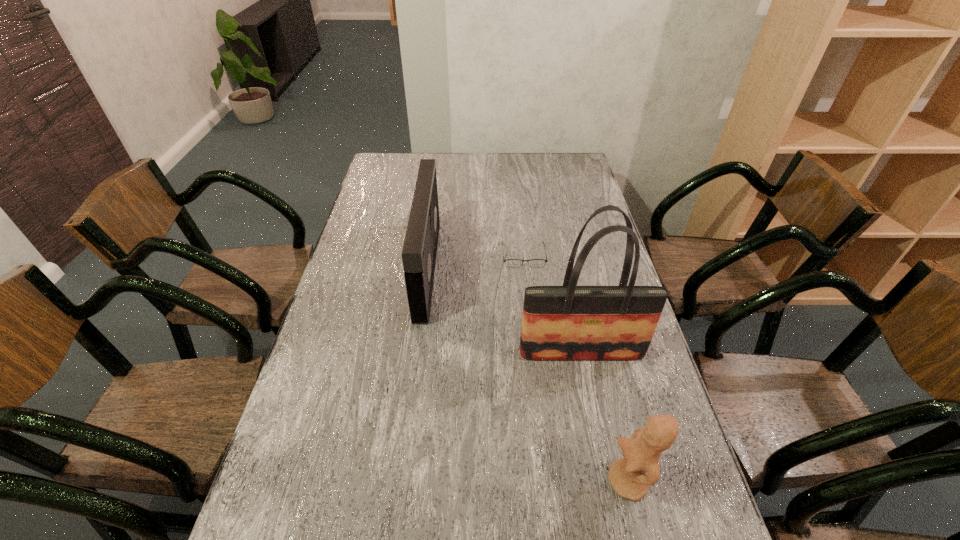
This screenshot has height=540, width=960. Find the location of `free space located on the front-facing side of the spectacles`. free space located on the front-facing side of the spectacles is located at coordinates (529, 307).

Identify the location of shopping bag located at the right edge. (569, 322).

Where is `figurine that is at the right edge`? figurine that is at the right edge is located at coordinates (630, 476).

Where is `vacant area at the far edge`? The height and width of the screenshot is (540, 960). vacant area at the far edge is located at coordinates (541, 174).

Where is `vacant area at the left edge`? vacant area at the left edge is located at coordinates (352, 283).

In the image, there is a desktop. What are the coordinates of `blank space at the right edge` in the screenshot? It's located at (596, 276).

Identify the location of vacant space at the far left corner of the desktop. This screenshot has width=960, height=540. (391, 174).

At what (x,y) coordinates should I click in order to perform the action: click on vacant space at the far right corner of the desktop. Please return your answer as a coordinate pair (x, y). Looking at the image, I should click on (555, 172).

This screenshot has width=960, height=540. In order to click on free space between the leftmost object and the shortest object in this screenshot , I will do `click(475, 262)`.

The width and height of the screenshot is (960, 540). Find the location of `vacant point located between the nearest object and the shortest object`. vacant point located between the nearest object and the shortest object is located at coordinates (576, 368).